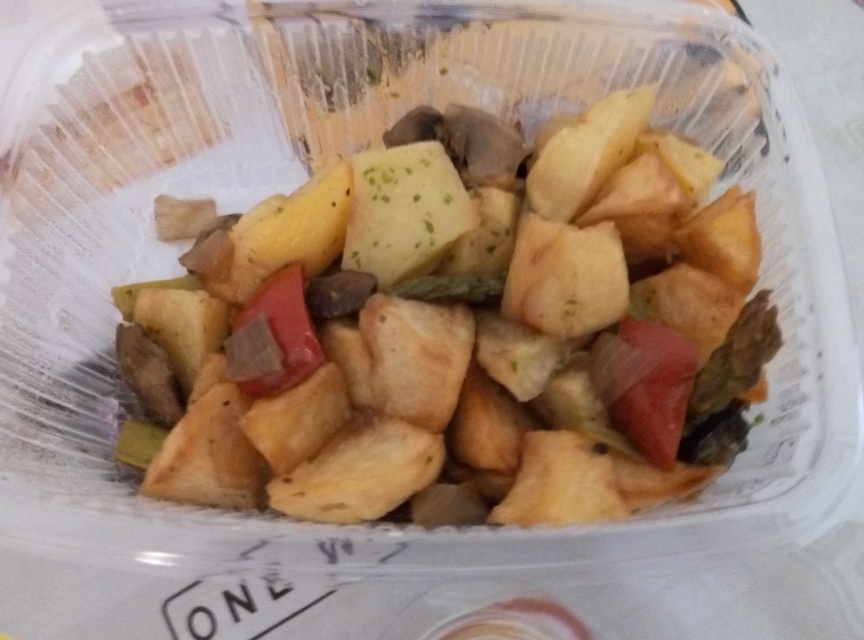
Is golden brown fried potatoes at center bigger than red matte tomato at center?

Yes.

Consider the image. Who is more distant from viewer, (526,452) or (672,332)?

The point (672,332) is behind.

Between point (334, 202) and point (658, 339), which one is positioned in front?

Point (658, 339) is more forward.

Image resolution: width=864 pixels, height=640 pixels. What are the coordinates of `golden brown fried potatoes at center` in the screenshot? It's located at (467, 326).

Which is below, red matte tomato at center or matte brown pepper at center?

Positioned lower is red matte tomato at center.

Is red matte tomato at center to the left of matte brown pepper at center from the viewer's perspective?

No, red matte tomato at center is not to the left of matte brown pepper at center.

Who is more forward, [653,352] or [272,348]?

Positioned in front is point [272,348].

Identify the location of red matte tomato at center. (645, 385).

Is golden brown fried potatoes at center bigger than matte brown pepper at center?

Yes.

Describe the element at coordinates (467, 326) in the screenshot. I see `golden brown fried potatoes at center` at that location.

Does point (634, 490) lie behind point (296, 362)?

No, it is in front of (296, 362).

In order to click on golden brown fried potatoes at center in this screenshot , I will do `click(467, 326)`.